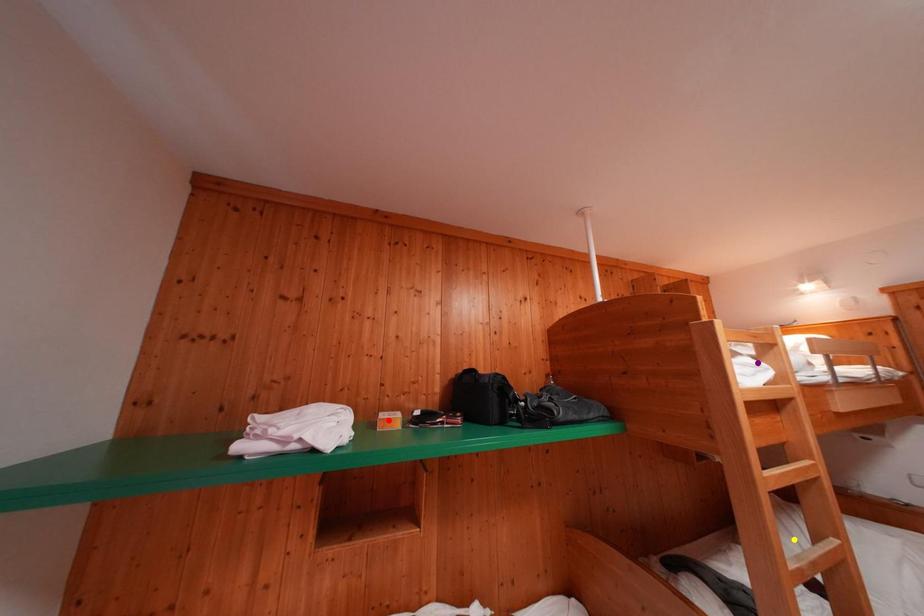
Order these from nearest to farthest:
red point | purple point | yellow point

1. purple point
2. yellow point
3. red point